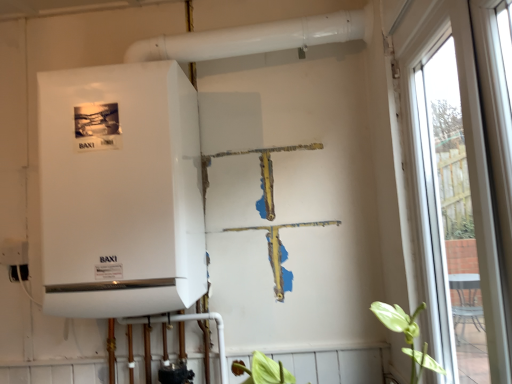
What do you see at coordinates (456, 179) in the screenshot?
I see `transparent glass window at right` at bounding box center [456, 179].

Measure the distance between point (411, 170) and camera.

A distance of 4.14 feet exists between point (411, 170) and camera.

I want to click on transparent glass window at right, so click(x=456, y=179).

Describe the element at coordinates (120, 191) in the screenshot. I see `white glossy boiler at left` at that location.

I want to click on white glossy boiler at left, so click(x=120, y=191).

In order to click on transparent glass window at right in this screenshot , I will do `click(456, 179)`.

Is white glossy boiler at left to the right of transparent glass window at right from the viewer's perspective?

Incorrect, white glossy boiler at left is not on the right side of transparent glass window at right.

Considering their positions, is white glossy boiler at left located in front of or behind transparent glass window at right?

Clearly, white glossy boiler at left is behind transparent glass window at right.

Considering the positions of point (123, 81) and point (417, 93), is point (123, 81) closer or farther from the camera than point (417, 93)?

Point (123, 81) is farther from the camera than point (417, 93).

Looking at this image, from the image's perspective, is white glossy boiler at left on top of transparent glass window at right?

Yes.

From a real-world perspective, between white glossy boiler at left and transparent glass window at right, who is vertically higher?

white glossy boiler at left, from a real-world perspective.

Which of these two, white glossy boiler at left or transparent glass window at right, is wider?

With larger width is white glossy boiler at left.

Does white glossy boiler at left have a greater height compared to transparent glass window at right?

No.

In terms of size, does white glossy boiler at left appear bigger or smaller than transparent glass window at right?

Clearly, white glossy boiler at left is larger in size than transparent glass window at right.

Does white glossy boiler at left contain transparent glass window at right?

No, transparent glass window at right is not inside white glossy boiler at left.

Would you say white glossy boiler at left is a long distance from transparent glass window at right?

No, white glossy boiler at left is in close proximity to transparent glass window at right.

Could you tell me if white glossy boiler at left is facing transparent glass window at right?

No, white glossy boiler at left is not turned towards transparent glass window at right.

Can you tell me how much white glossy boiler at left and transparent glass window at right differ in facing direction?

The angular difference between white glossy boiler at left and transparent glass window at right is 87.3 degrees.

What are the coordinates of `appliance that appears on the left of transparent glass window at right` in the screenshot? It's located at (120, 191).

Is transparent glass window at right to the left or to the right of white glossy boiler at left in the image?

transparent glass window at right is positioned on white glossy boiler at left's right side.

Which is behind, transparent glass window at right or white glossy boiler at left?

Positioned behind is white glossy boiler at left.

Does point (386, 43) come farther from viewer compared to point (167, 291)?

That is True.

In the scene shown: From the image's perspective, between transparent glass window at right and white glossy boiler at left, which one is located above?

white glossy boiler at left, from the image's perspective.

From a real-world perspective, relative to white glossy boiler at left, is transparent glass window at right vertically above or below?

From a real-world perspective, transparent glass window at right is physically below white glossy boiler at left.

Considering the sizes of transparent glass window at right and white glossy boiler at left in the image, is transparent glass window at right wider or thinner than white glossy boiler at left?

transparent glass window at right is thinner than white glossy boiler at left.

Considering the relative sizes of transparent glass window at right and white glossy boiler at left in the image provided, is transparent glass window at right taller than white glossy boiler at left?

Correct, transparent glass window at right is much taller as white glossy boiler at left.

Can you confirm if transparent glass window at right is bigger than white glossy boiler at left?

Actually, transparent glass window at right might be smaller than white glossy boiler at left.

Would you say transparent glass window at right is outside white glossy boiler at left?

Indeed, transparent glass window at right is completely outside white glossy boiler at left.

Are transparent glass window at right and white glossy boiler at left far apart?

No, transparent glass window at right is in close proximity to white glossy boiler at left.

Is transparent glass window at right turned away from white glossy boiler at left?

No.

Can you tell me how much transparent glass window at right and white glossy boiler at left differ in facing direction?

transparent glass window at right and white glossy boiler at left are facing 87.3 degrees away from each other.

Locate an element on the screen. The image size is (512, 384). window lying on the right of white glossy boiler at left is located at coordinates (456, 179).

The width and height of the screenshot is (512, 384). Identify the location of window that appears on the right of white glossy boiler at left. (456, 179).

There is a transparent glass window at right. At what (x,y) coordinates should I click in order to perform the action: click on appliance above it (from a real-world perspective). Please return your answer as a coordinate pair (x, y). Looking at the image, I should click on (120, 191).